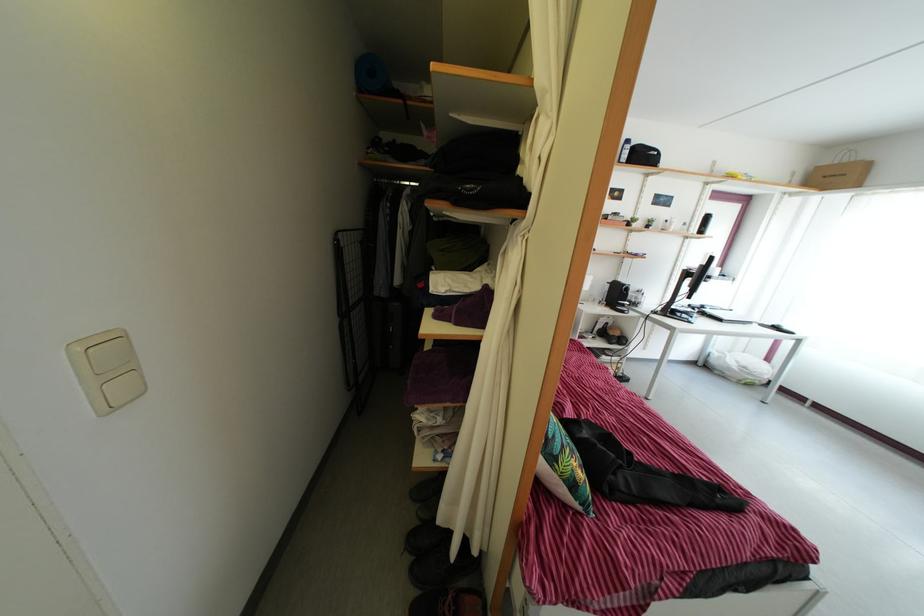
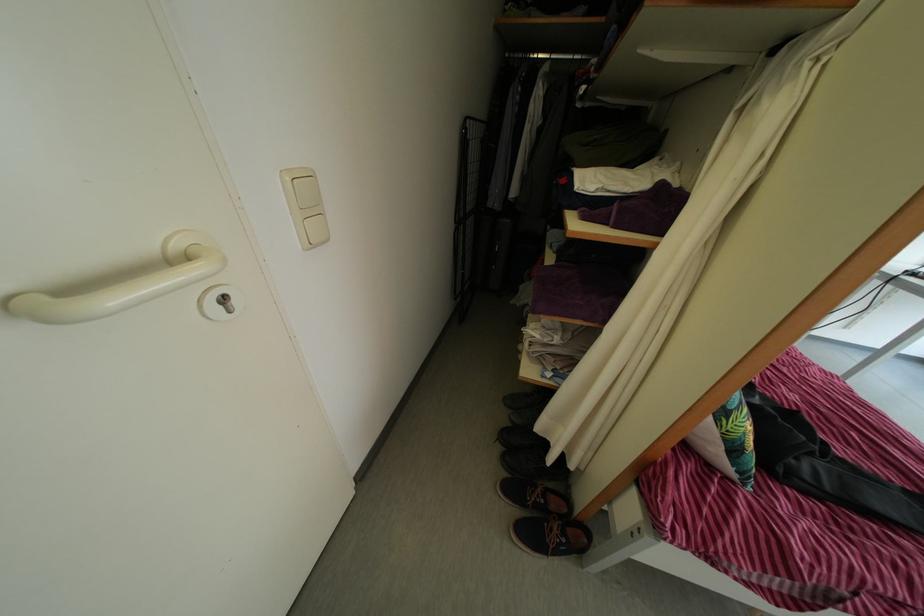
Where in the second image is the point corresponding to point 570,488 from the first image?

(732, 448)